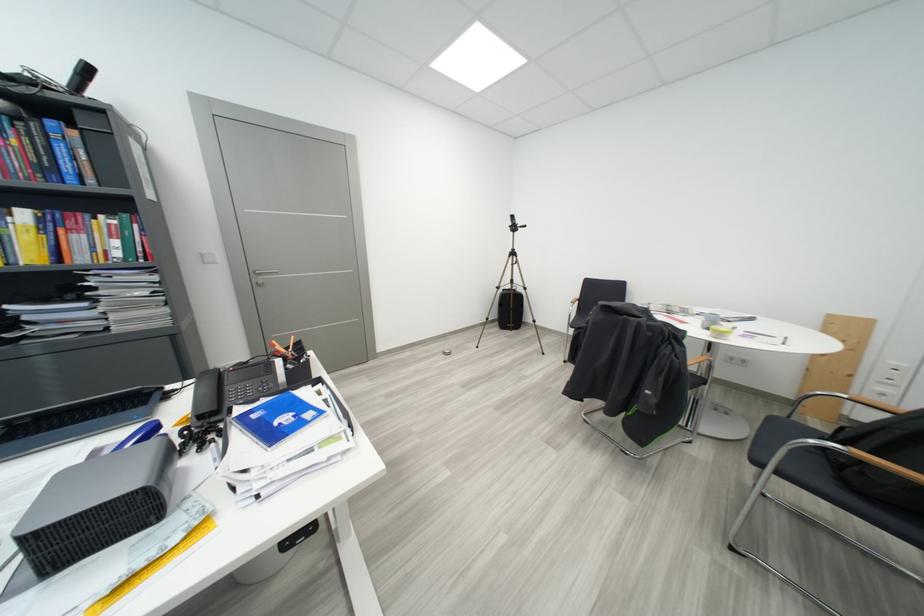
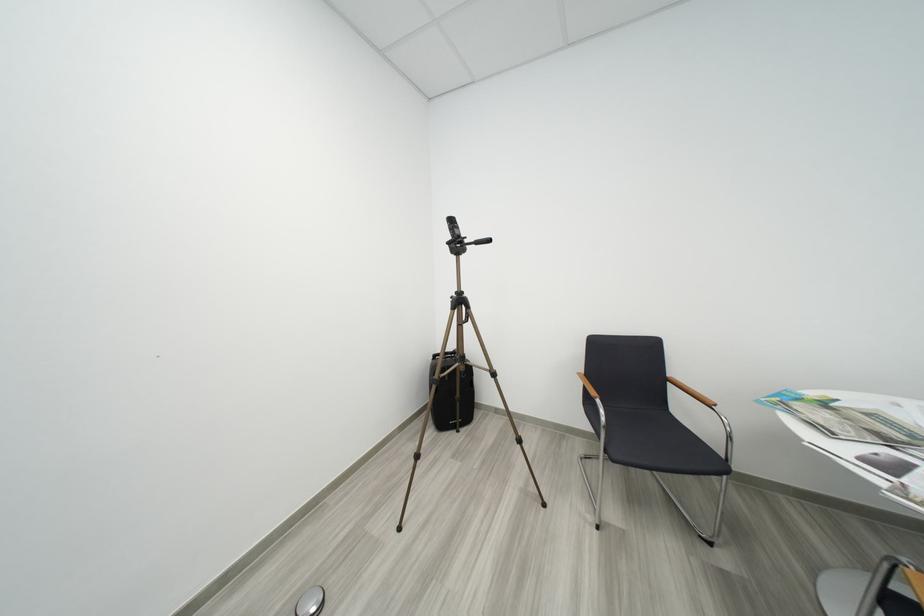
Question: What movement of the cameraman would produce the second image?

Choices:
 (A) Left
 (B) Right
 (C) Forward
 (D) Backward

Answer: (C)